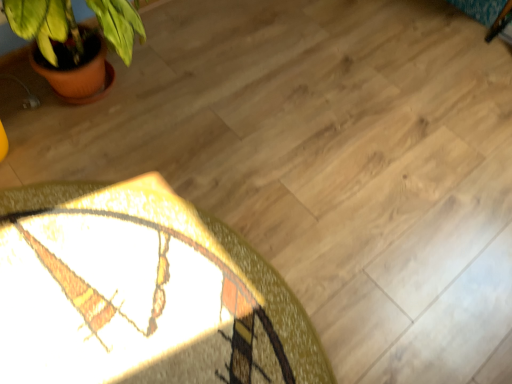
This screenshot has height=384, width=512. Find the location of `shiny glass table at center`. shiny glass table at center is located at coordinates (140, 294).

What do you see at coordinates (140, 294) in the screenshot? I see `shiny glass table at center` at bounding box center [140, 294].

Measure the distance between point (137, 240) and camera.

Point (137, 240) is 4.12 feet from camera.

The height and width of the screenshot is (384, 512). Identify the location of shiny glass table at center. (140, 294).